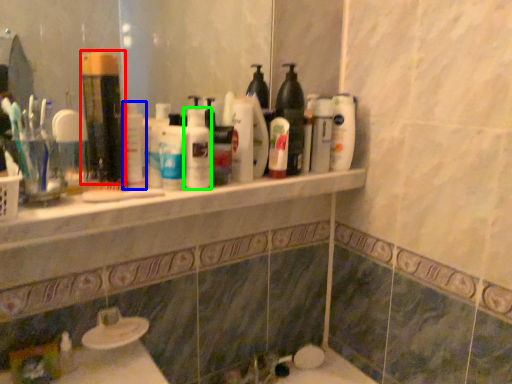
Question: Which is farther away from mouthwash (highlighted by a red box)? cleaning product (highlighted by a blue box) or cleaning product (highlighted by a green box)?

Choices:
 (A) cleaning product
 (B) cleaning product

Answer: (B)